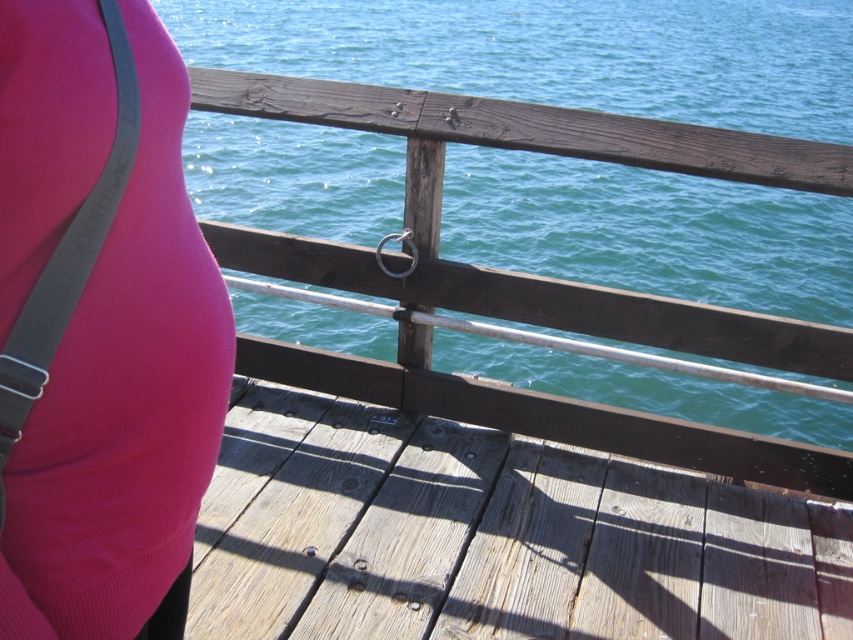
Is teal water at center wider than weathered wood deck at center?

Correct, the width of teal water at center exceeds that of weathered wood deck at center.

Does teal water at center appear under weathered wood deck at center?

No.

Which is in front, point (451, 33) or point (389, 632)?

Point (389, 632) is more forward.

Identify the location of teal water at center. The image size is (853, 640). (556, 52).

Can you confirm if weathered wood deck at center is taller than matte pink fabric at center?

Incorrect, weathered wood deck at center's height is not larger of matte pink fabric at center's.

Is weathered wood deck at center in front of matte pink fabric at center?

No, it is behind matte pink fabric at center.

Between point (258, 577) and point (165, 209), which one is positioned in front?

Point (165, 209) is more forward.

Find the location of a particular element. weathered wood deck at center is located at coordinates (503, 515).

How distant is teal water at center from matte pink fabric at center?

A distance of 7.77 meters exists between teal water at center and matte pink fabric at center.

Who is more distant from viewer, [587,216] or [154,38]?

Positioned behind is point [587,216].

Does point (824, 67) come closer to viewer compared to point (178, 228)?

No, (824, 67) is further to viewer.

Image resolution: width=853 pixels, height=640 pixels. I want to click on teal water at center, so click(x=556, y=52).